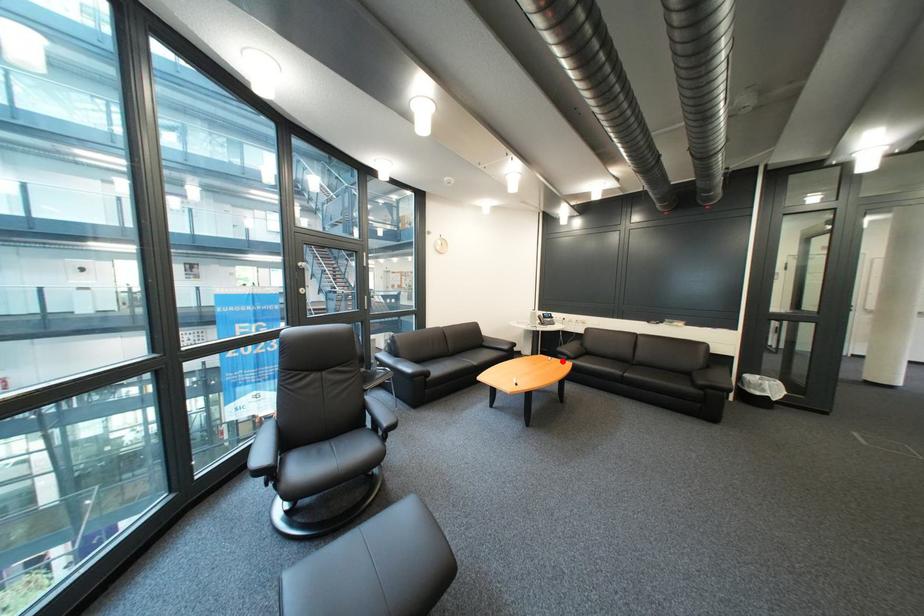
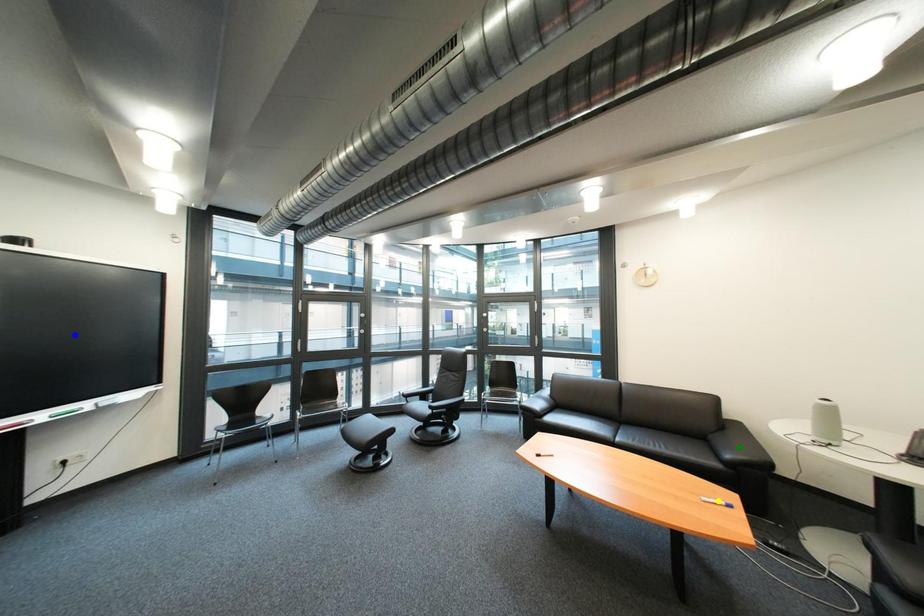
Question: I am providing you with two images of the same scene from different viewpoints. A red point is marked on the first image. You are given multiple points on the second image. Which point in image 2 is actually the same real-world point as the red point in image 1?

Choices:
 (A) blue point
 (B) yellow point
 (C) green point

Answer: (B)